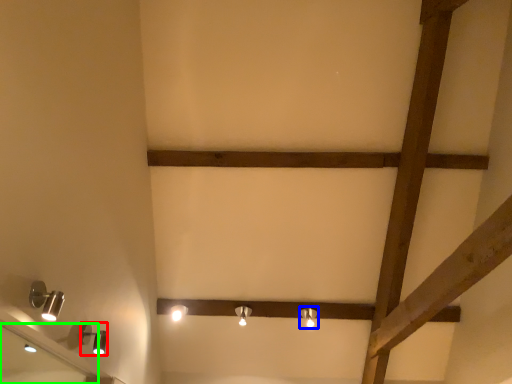
Question: Based on their relative distances, which object is nearer to lamp (highlighted by a red box)? Choose from lamp (highlighted by a blue box) and mirror (highlighted by a green box).

Choices:
 (A) lamp
 (B) mirror

Answer: (B)